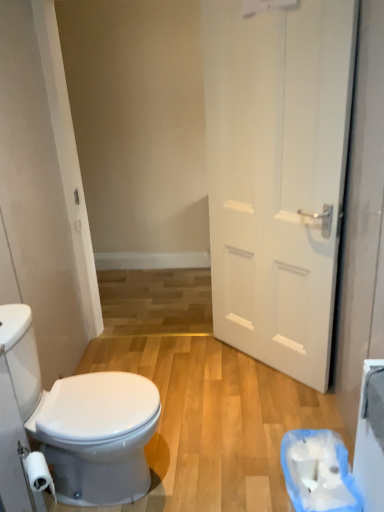
Question: Is white matte door at right wider or thinner than white glossy bidet at lower left?

Choices:
 (A) wide
 (B) thin

Answer: (B)

Question: Is point (243, 190) positioned closer to the camera than point (59, 416)?

Choices:
 (A) farther
 (B) closer

Answer: (A)

Question: Which is nearer to the white glossy bidet at lower left?

Choices:
 (A) white matte door at right
 (B) white paper at lower right, which is counted as the 1th toilet paper, starting from the back
 (C) white matte toilet paper at lower left, arranged as the 2th toilet paper when viewed from the back

Answer: (C)

Question: Which is nearer to the white matte toilet paper at lower left, which appears as the 1th toilet paper when viewed from the front?

Choices:
 (A) white glossy bidet at lower left
 (B) white paper at lower right, acting as the first toilet paper starting from the right
 (C) white matte door at right

Answer: (A)